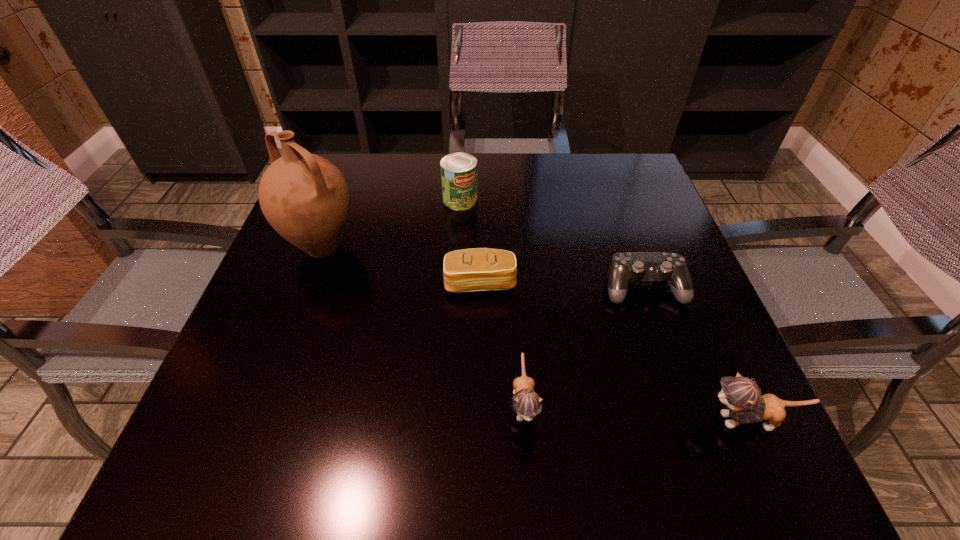
You are a GUI agent. You are given a task and a screenshot of the screen. Output one action in this format:
    pyautogui.click(x=<x>, y=<y>)
    Task: Click on the shorter kitten
    Image resolution: width=960 pixels, height=540 pixels.
    Given the screenshot: What is the action you would take?
    pyautogui.click(x=526, y=403)

I want to click on the left kitten, so click(x=526, y=403).

Find the location of a particular element. The width and height of the screenshot is (960, 540). the right kitten is located at coordinates (746, 405).

Where is `can`? This screenshot has height=540, width=960. can is located at coordinates [x=458, y=170].

You are a GUI agent. You are given a task and a screenshot of the screen. Output one action in this format:
    pyautogui.click(x=<x>, y=<y>)
    Task: Click on the control
    
    Given the screenshot: What is the action you would take?
    [x=625, y=267]

Find the location of a particular element. pitcher is located at coordinates (305, 198).

Image resolution: width=960 pixels, height=540 pixels. In order to click on the leftmost object in this screenshot , I will do `click(305, 198)`.

Find the location of `clutch bag`. clutch bag is located at coordinates (480, 269).

Identify the location of vacant space located on the front-facing side of the taller kitten. This screenshot has width=960, height=540. (655, 420).

You are a GUI agent. You are given a task and a screenshot of the screen. Output one action in this format:
    pyautogui.click(x=<x>, y=<y>)
    Task: Click on the vacant region located 0.160m on the front-facing side of the taller kitten
    
    Given the screenshot: What is the action you would take?
    pyautogui.click(x=599, y=420)